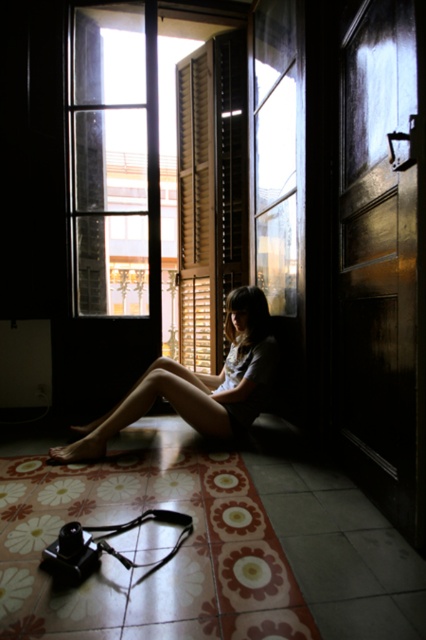
Is the position of matte skin girl at center less distant than that of wooden at center?

Yes, it is.

The height and width of the screenshot is (640, 426). I want to click on matte skin girl at center, so click(198, 385).